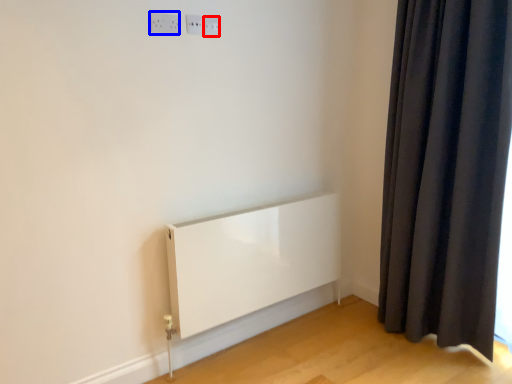
Question: Which object is closer to the camera taking this photo, electric outlet (highlighted by a red box) or electric outlet (highlighted by a blue box)?

Choices:
 (A) electric outlet
 (B) electric outlet

Answer: (B)